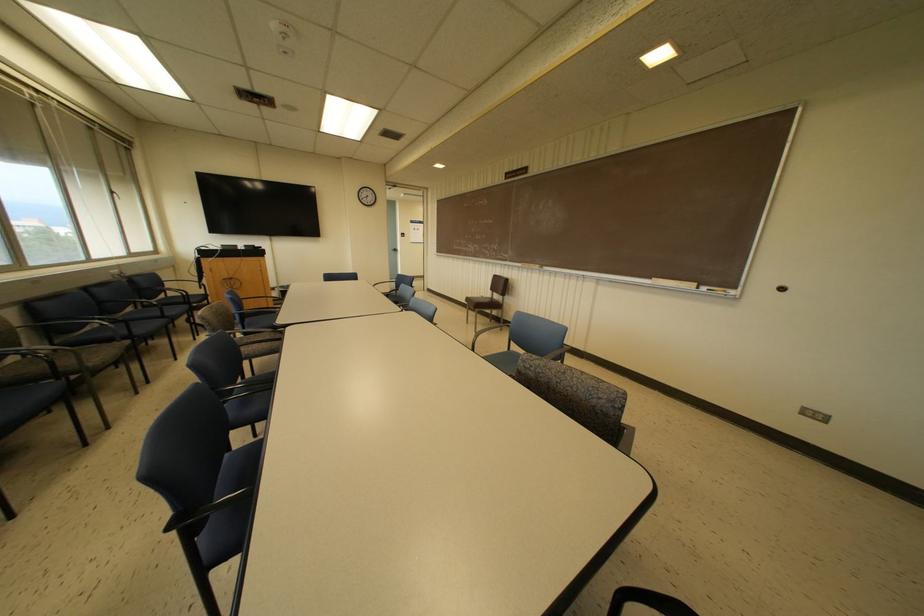
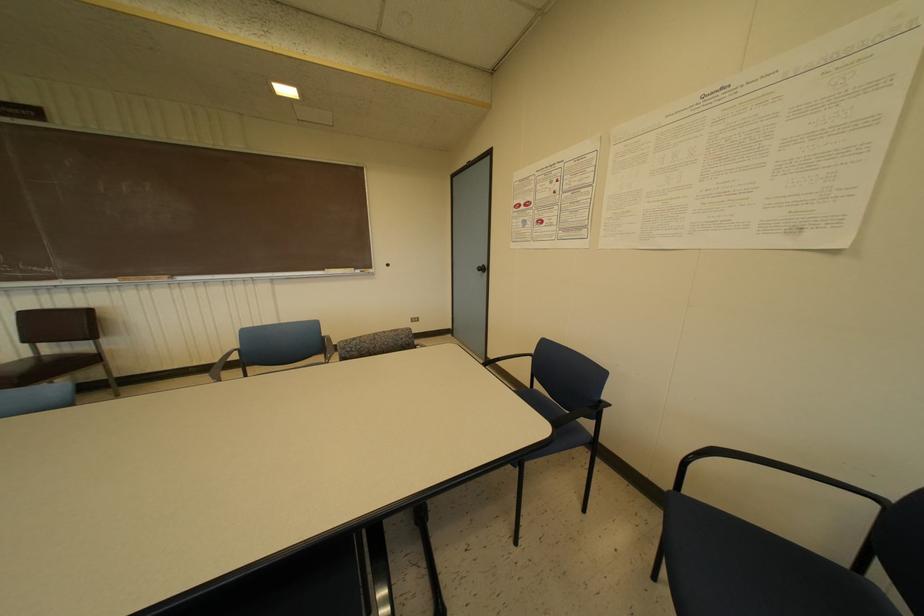
Question: The camera is either moving clockwise (left) or counter-clockwise (right) around the object. The first image is from the beginning of the video and the second image is from the end. Is the camera moving left or right when shooting the video?

Choices:
 (A) Left
 (B) Right

Answer: (A)